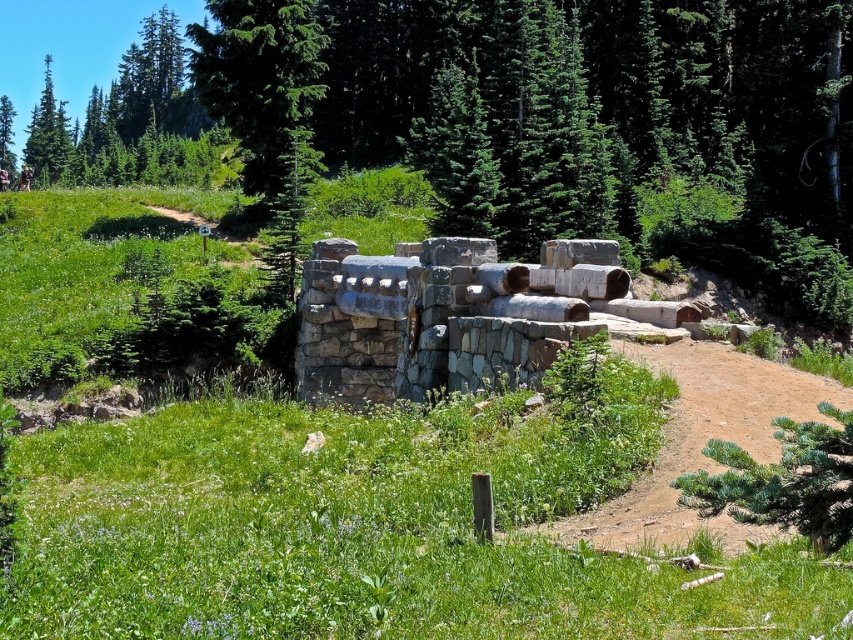
You are a hiker standing at the dirt path and looking towards the stone structure. You notice two trees at the upper left corner of your view. Which tree is closer to you between the green coniferous tree at upper left and the green textured tree at upper left?

The green coniferous tree at upper left is closer to you since it is in front of the green textured tree at upper left.